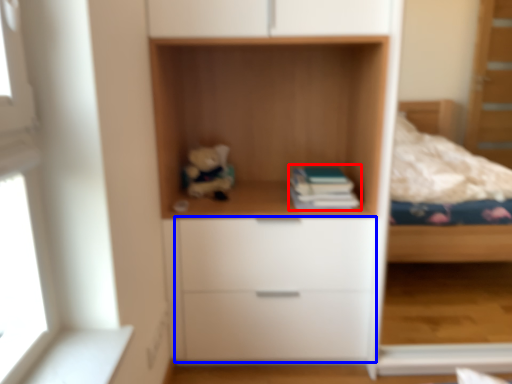
Question: Which point is further to the camera, paperback book (highlighted by a red box) or drawer (highlighted by a blue box)?

Choices:
 (A) paperback book
 (B) drawer

Answer: (A)